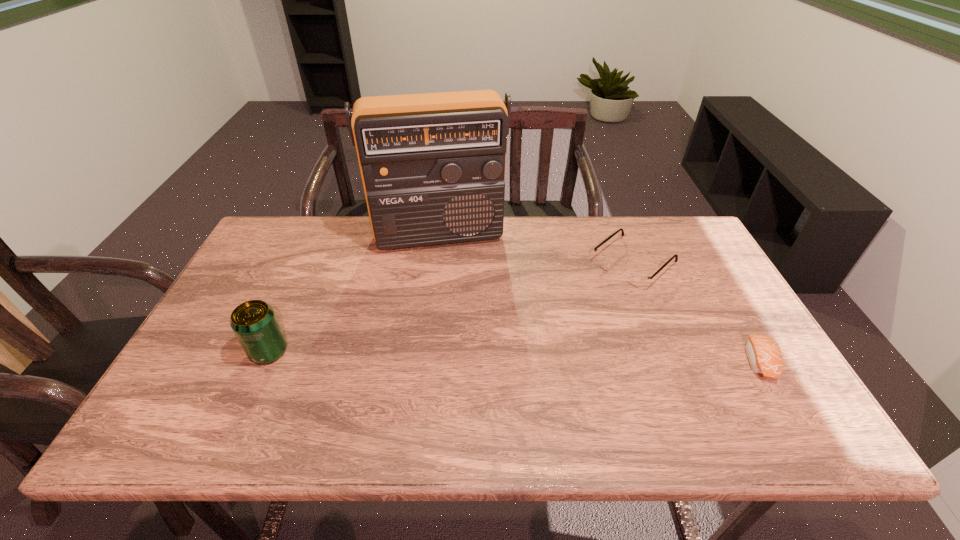
Locate an element on the screen. Image resolution: width=960 pixels, height=540 pixels. vacant space on the desktop that is between the leftmost object and the rightmost object and is positioned at the hinge ends of the second shortest object is located at coordinates (527, 356).

Locate an element on the screen. vacant spot on the desktop that is between the third shortest object and the rightmost object and is positioned on the front-facing side of the third object from right to left is located at coordinates (458, 355).